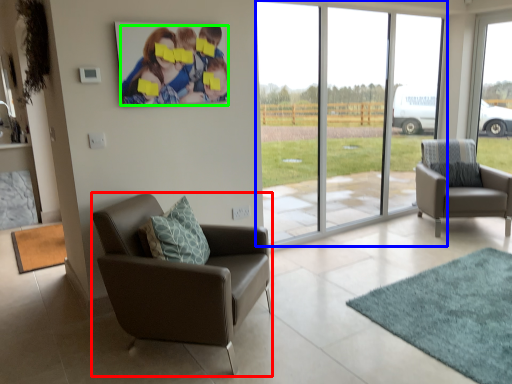
Question: Based on their relative distances, which object is nearer to chair (highlighted by a red box)? Choose from window (highlighted by a blue box) and couple (highlighted by a green box).

Choices:
 (A) window
 (B) couple

Answer: (B)